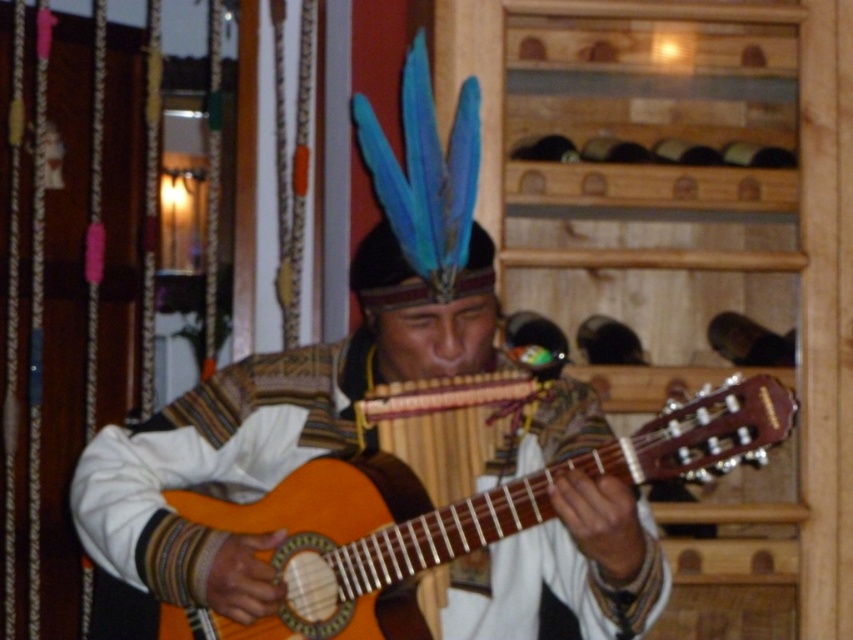
Can you confirm if wooden guitar at center is positioned above wooden acoustic guitar at center?

Yes.

Which is behind, point (161, 532) or point (694, 472)?

The point (161, 532) is more distant.

Identify the location of wooden guitar at center. The height and width of the screenshot is (640, 853). pyautogui.click(x=270, y=432).